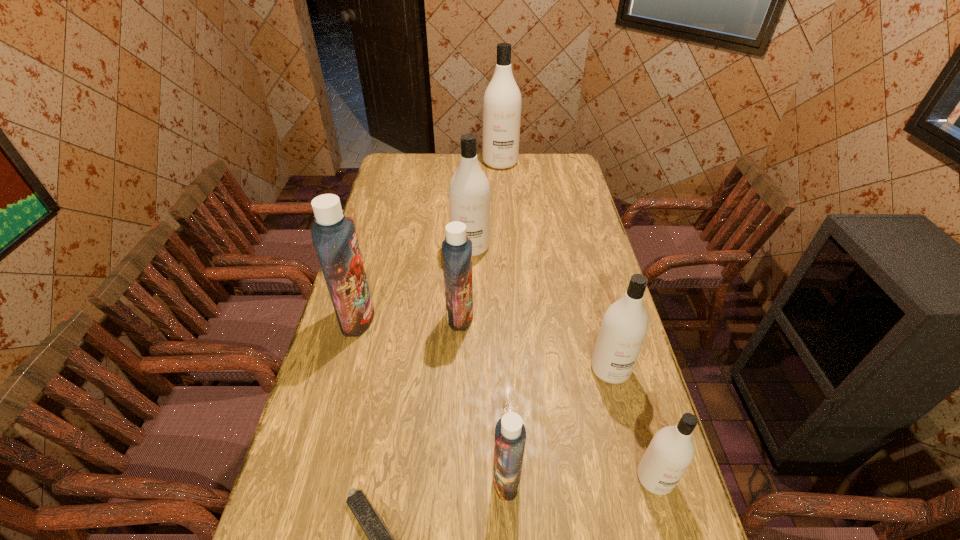
Where is `the nearest blue shampoo`? the nearest blue shampoo is located at coordinates (510, 434).

Locate an element on the screen. The height and width of the screenshot is (540, 960). the nearest white shampoo is located at coordinates tap(670, 453).

This screenshot has height=540, width=960. I want to click on vacant area situated on the front-facing side of the farthest shampoo, so click(503, 200).

Identify the location of free region located 0.280m on the front label of the leftmost object. This screenshot has width=960, height=540. (460, 318).

Find the location of a particular element. This screenshot has height=540, width=960. free space located 0.050m on the front-facing side of the second farthest object is located at coordinates (470, 268).

What are the coordinates of `free region located 0.130m on the front label of the second blue shampoo from left to right` in the screenshot? It's located at (513, 316).

You are a GUI agent. You are given a task and a screenshot of the screen. Output one action in this format:
    pyautogui.click(x=<x>, y=<y>)
    Task: Click on the free space located on the front-facing side of the third nearest shampoo
    The height and width of the screenshot is (540, 960).
    Given the screenshot: What is the action you would take?
    pyautogui.click(x=645, y=502)

You are a GUI agent. You are given a task and a screenshot of the screen. Output one action in this format:
    pyautogui.click(x=<x>, y=<y>)
    Task: Click on the vacant space situated 0.140m on the front label of the rightmost blue shampoo
    This screenshot has height=540, width=960.
    Given the screenshot: What is the action you would take?
    pyautogui.click(x=435, y=480)

This screenshot has height=540, width=960. I want to click on free space located 0.160m on the front label of the rightmost blue shampoo, so click(x=426, y=480).

The height and width of the screenshot is (540, 960). Find the location of `free location located 0.260m on the front label of the rightmost blue shampoo`. free location located 0.260m on the front label of the rightmost blue shampoo is located at coordinates [384, 480].